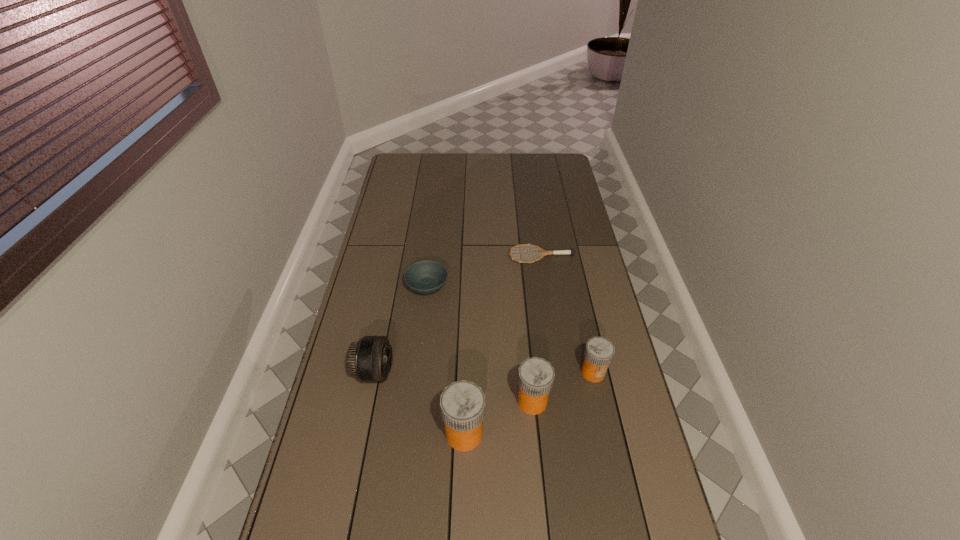
At what (x,y) coordinates should I click in order to perform the action: click on the fourth object from right to left. Please return your answer as a coordinate pair (x, y). Looking at the image, I should click on (462, 403).

Find the location of a particular element. the second shortest medicine is located at coordinates [x=536, y=375].

This screenshot has height=540, width=960. I want to click on the shortest medicine, so click(x=599, y=351).

Locate an element on the screen. The width and height of the screenshot is (960, 540). the farthest medicine is located at coordinates (599, 351).

Identify the location of telephoto lens. (370, 359).

You are a GUI agent. You are given a task and a screenshot of the screen. Output one action in this format:
    pyautogui.click(x=<x>, y=<y>)
    Task: Click on the shortest object
    Image resolution: width=960 pixels, height=540 pixels.
    Given the screenshot: What is the action you would take?
    pyautogui.click(x=543, y=252)

Find the location of `the farthest object`. the farthest object is located at coordinates (543, 252).

The width and height of the screenshot is (960, 540). In order to click on the fifth nearest object in this screenshot , I will do `click(425, 277)`.

Where is `soup bowl`? This screenshot has height=540, width=960. soup bowl is located at coordinates (425, 277).

The height and width of the screenshot is (540, 960). What are the coordinates of `vacant region located on the label side of the third object from left to right` in the screenshot? It's located at (621, 434).